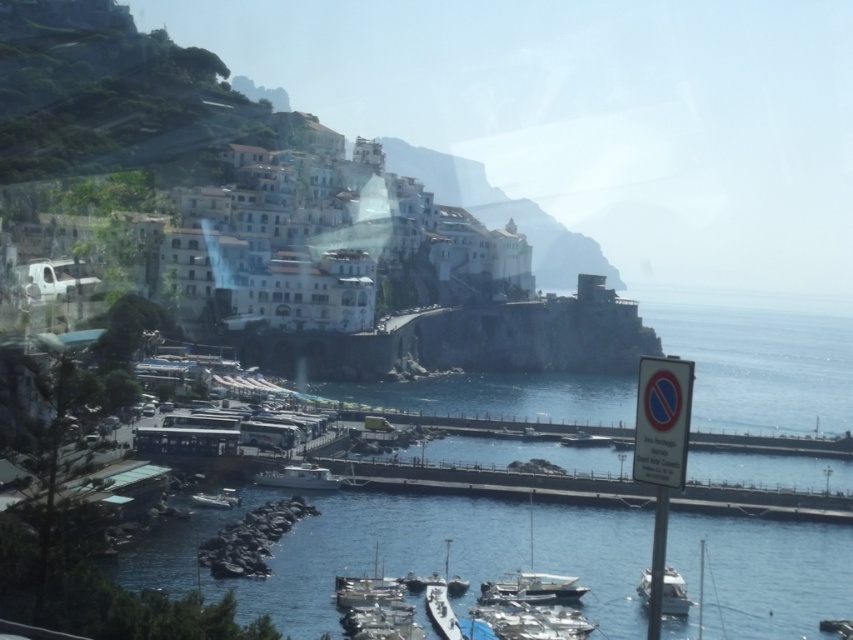
Based on the photo, between white glossy boat at center and white glossy boat at lower right, which one has more height?

white glossy boat at lower right

In the scene shown: Can you confirm if white glossy boat at center is shorter than white glossy boat at lower right?

Indeed, white glossy boat at center has a lesser height compared to white glossy boat at lower right.

Between point (337, 480) and point (683, 586), which one is positioned behind?

The point (337, 480) is more distant.

This screenshot has width=853, height=640. Find the location of `white glossy boat at center`. white glossy boat at center is located at coordinates (299, 477).

In the scene shown: Can you confirm if white glossy sailboat at lower center is bigger than white glossy boat at center?

Yes, white glossy sailboat at lower center is bigger than white glossy boat at center.

Which is more to the right, white glossy sailboat at lower center or white glossy boat at center?

From the viewer's perspective, white glossy sailboat at lower center appears more on the right side.

Is point (525, 580) more distant than point (322, 481)?

That is False.

I want to click on white glossy sailboat at lower center, so click(532, 582).

Is white glossy sailboat at lower center closer to camera compared to white glossy boat at lower right?

No, it is behind white glossy boat at lower right.

Is point (573, 580) positioned behind point (666, 605)?

Yes, point (573, 580) is farther from viewer.

Does point (497, 593) lie behind point (675, 588)?

That is False.

The width and height of the screenshot is (853, 640). What are the coordinates of `white glossy sailboat at lower center` in the screenshot? It's located at (532, 582).